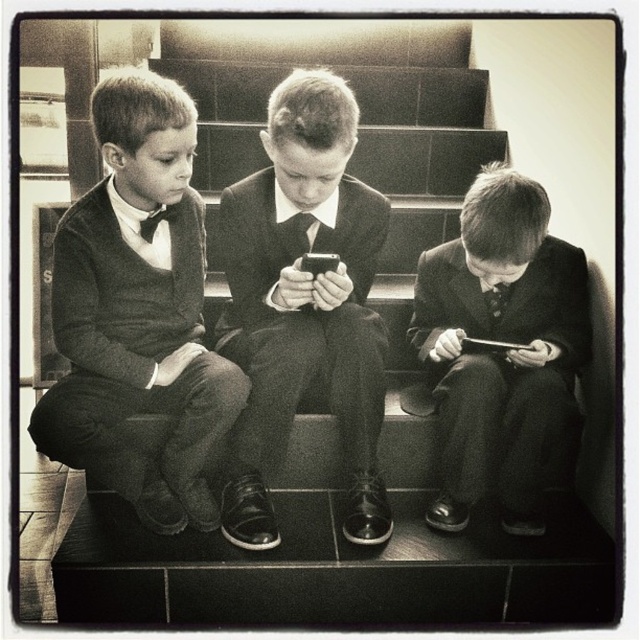
Question: Is matte black sweater at left behind smooth black suit at center?

Choices:
 (A) no
 (B) yes

Answer: (B)

Question: Considering the real-world distances, which object is farthest from the smooth suit at center?

Choices:
 (A) black matte smartphone at center
 (B) smooth black suit at center

Answer: (A)

Question: Among these points, which one is nearest to the camera?

Choices:
 (A) (x=368, y=513)
 (B) (x=108, y=378)
 (C) (x=428, y=353)

Answer: (B)

Question: Which point is closer to the camera?

Choices:
 (A) smooth black suit at center
 (B) black matte smartphone at center
 (C) matte black sweater at left
 (D) smooth suit at center

Answer: (A)

Question: Does smooth black suit at center lie behind smooth suit at center?

Choices:
 (A) no
 (B) yes

Answer: (A)

Question: Is the position of matte black sweater at left less distant than that of smooth black suit at center?

Choices:
 (A) no
 (B) yes

Answer: (A)